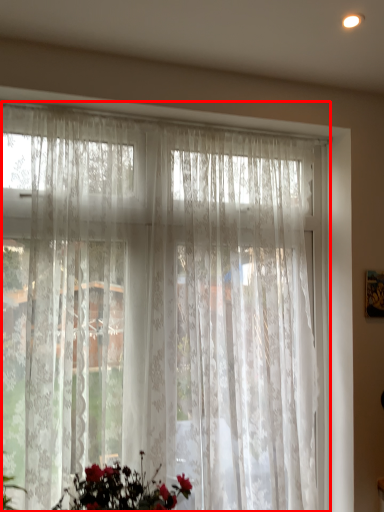
Question: From the image, what is the correct spatial relationship of curtain (annotated by the red box) in relation to floral arrangement?

Choices:
 (A) left
 (B) right

Answer: (B)